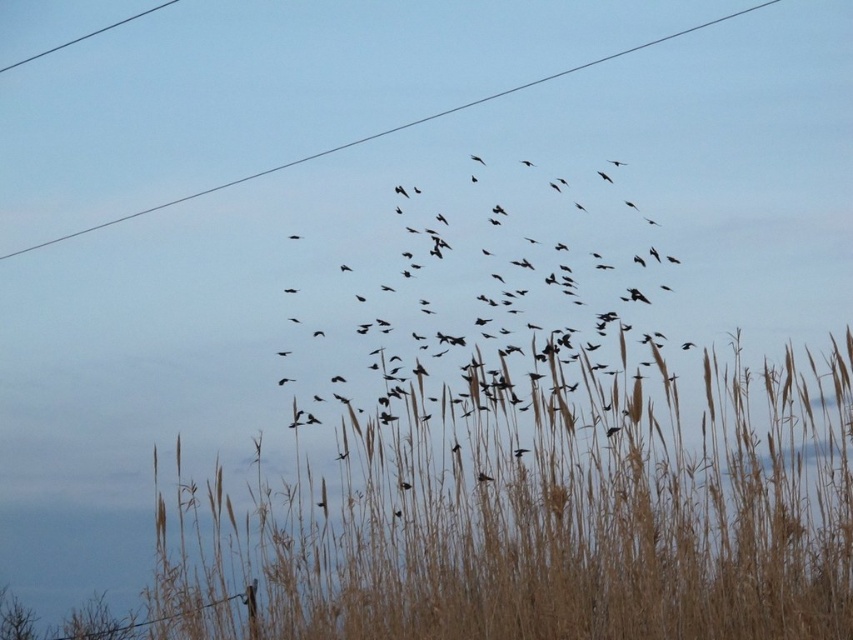
From the picture: Between black wire at upper center and black wire at upper left, which one is positioned higher?

Positioned higher is black wire at upper left.

Can you confirm if black wire at upper center is thinner than black wire at upper left?

No, black wire at upper center is not thinner than black wire at upper left.

The image size is (853, 640). Describe the element at coordinates (386, 131) in the screenshot. I see `black wire at upper center` at that location.

The width and height of the screenshot is (853, 640). In order to click on black wire at upper center in this screenshot , I will do `click(386, 131)`.

Which is below, brown dry grass at lower center or black matte birds at center?

brown dry grass at lower center is below.

Where is `brown dry grass at lower center`? The height and width of the screenshot is (640, 853). brown dry grass at lower center is located at coordinates (525, 518).

I want to click on brown dry grass at lower center, so click(525, 518).

Does black matte birds at center have a greater width compared to black wire at upper center?

In fact, black matte birds at center might be narrower than black wire at upper center.

Is point (364, 385) positioned before point (28, 248)?

That is True.

Describe the element at coordinates (492, 282) in the screenshot. This screenshot has height=640, width=853. I see `black matte birds at center` at that location.

You are a GUI agent. You are given a task and a screenshot of the screen. Output one action in this format:
    pyautogui.click(x=<x>, y=<y>)
    Task: Click on the black matte birds at center
    
    Given the screenshot: What is the action you would take?
    pyautogui.click(x=492, y=282)